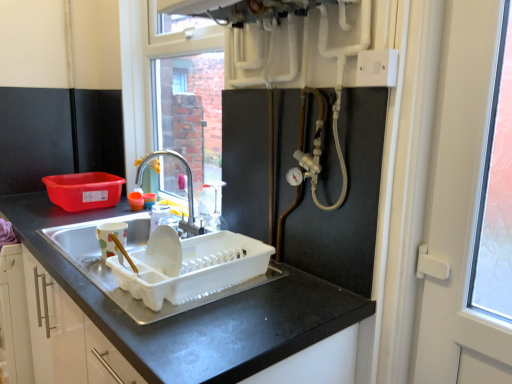
Question: From the image's perspective, does brushed metal faucet at center appear lower than white plastic screen door at right?

Choices:
 (A) yes
 (B) no

Answer: (B)

Question: Is brushed metal faucet at center far away from white plastic screen door at right?

Choices:
 (A) no
 (B) yes

Answer: (B)

Question: Does brushed metal faucet at center have a smaller size compared to white plastic screen door at right?

Choices:
 (A) no
 (B) yes

Answer: (B)

Question: Is the depth of brushed metal faucet at center less than that of white plastic screen door at right?

Choices:
 (A) yes
 (B) no

Answer: (B)

Question: Considering the relative sizes of brushed metal faucet at center and white plastic screen door at right in the image provided, is brushed metal faucet at center shorter than white plastic screen door at right?

Choices:
 (A) no
 (B) yes

Answer: (B)

Question: In terms of width, does white plastic dish rack at sink, the 1th appliance when ordered from right to left, look wider or thinner when compared to white plastic electric outlet at upper right?

Choices:
 (A) wide
 (B) thin

Answer: (A)

Question: Based on their sizes in the image, would you say white plastic dish rack at sink, which is the second appliance in left-to-right order, is bigger or smaller than white plastic electric outlet at upper right?

Choices:
 (A) big
 (B) small

Answer: (A)

Question: From the image's perspective, is white plastic dish rack at sink, the 1th appliance when ordered from right to left, above or below white plastic electric outlet at upper right?

Choices:
 (A) below
 (B) above

Answer: (A)

Question: From a real-world perspective, is white plastic dish rack at sink, the 1th appliance when ordered from right to left, positioned above or below white plastic electric outlet at upper right?

Choices:
 (A) below
 (B) above

Answer: (A)

Question: Considering the positions of white plastic screen door at right and white plastic electric outlet at upper right in the image, is white plastic screen door at right wider or thinner than white plastic electric outlet at upper right?

Choices:
 (A) wide
 (B) thin

Answer: (A)

Question: Does point [x=461, y=311] appear closer or farther from the camera than point [x=386, y=76]?

Choices:
 (A) farther
 (B) closer

Answer: (A)

Question: From the image's perspective, relative to white plastic electric outlet at upper right, is white plastic screen door at right above or below?

Choices:
 (A) below
 (B) above

Answer: (A)

Question: Relative to white plastic electric outlet at upper right, is white plastic screen door at right in front or behind?

Choices:
 (A) front
 (B) behind

Answer: (A)

Question: Looking at the image, does matte ceramic mug at left, the second appliance when ordered from right to left, seem bigger or smaller compared to black matte countertop at center?

Choices:
 (A) small
 (B) big

Answer: (A)

Question: Is matte ceramic mug at left, arranged as the first appliance when viewed from the left, inside the boundaries of black matte countertop at center, or outside?

Choices:
 (A) inside
 (B) outside

Answer: (B)